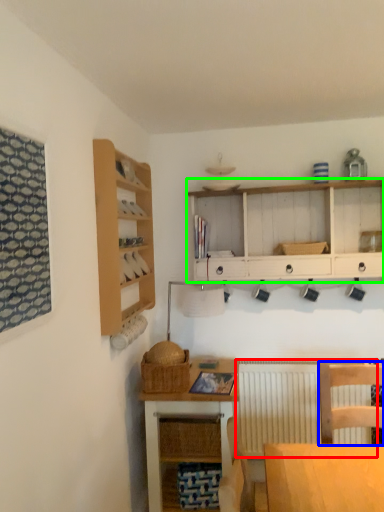
Question: Considering the real-world distances, which object is closest to radiator (highlighted by a red box)? chair (highlighted by a blue box) or cabinetry (highlighted by a green box).

Choices:
 (A) chair
 (B) cabinetry

Answer: (A)